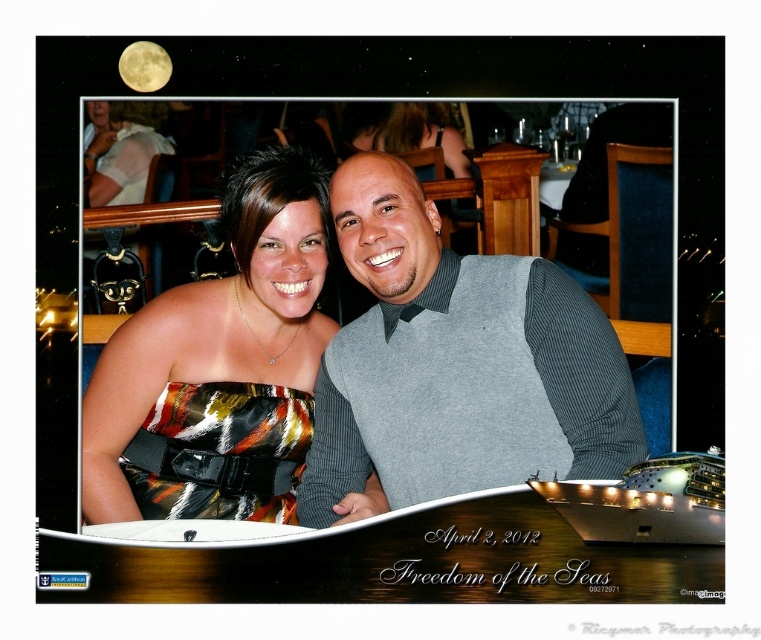
Who is lower down, gray ribbed sweater at center or shiny satin dress at center?

gray ribbed sweater at center is below.

Does point (403, 204) lie in front of point (224, 508)?

Yes, it is in front of point (224, 508).

Locate an element on the screen. This screenshot has height=640, width=761. gray ribbed sweater at center is located at coordinates (457, 362).